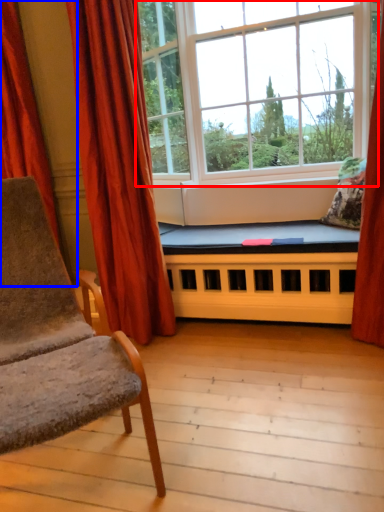
Question: Which object appears closest to the camera in this image, window (highlighted by a red box) or curtain (highlighted by a blue box)?

Choices:
 (A) window
 (B) curtain

Answer: (A)